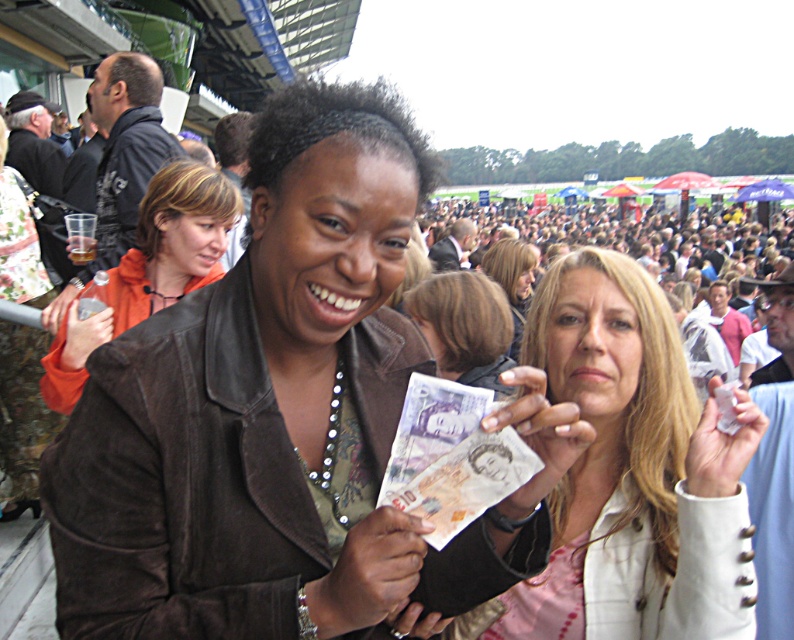
You are standing at the center of the stadium, looking towards the tiered seating. There is a point marked at coordinates point (758, 422). If you want to place a 2 meter tall banner between you and that point, will it fit without being cut off?

The distance of point (758, 422) from viewer is 2.12 meters. Since the banner is 2 meters tall, it will fit as the distance is greater than the banner height.

You are a photographer trying to capture a clear photo of the purple paper currency at center and the smooth brown hair at center. Which object should you focus on first to ensure it appears sharp in the final image?

You should focus on the purple paper currency at center first because it is closer to the viewer than the smooth brown hair at center, so focusing on it will keep it sharp while the background may blur.

You are a photographer standing at the center of the stadium trying to capture a photo of the white textured jacket at center. According to the coordinates provided, where should you aim your camera to ensure the jacket is centered in the frame?

The white textured jacket at center is located at coordinates point (x=630, y=474), so you should aim your camera at that point to center it in the frame.